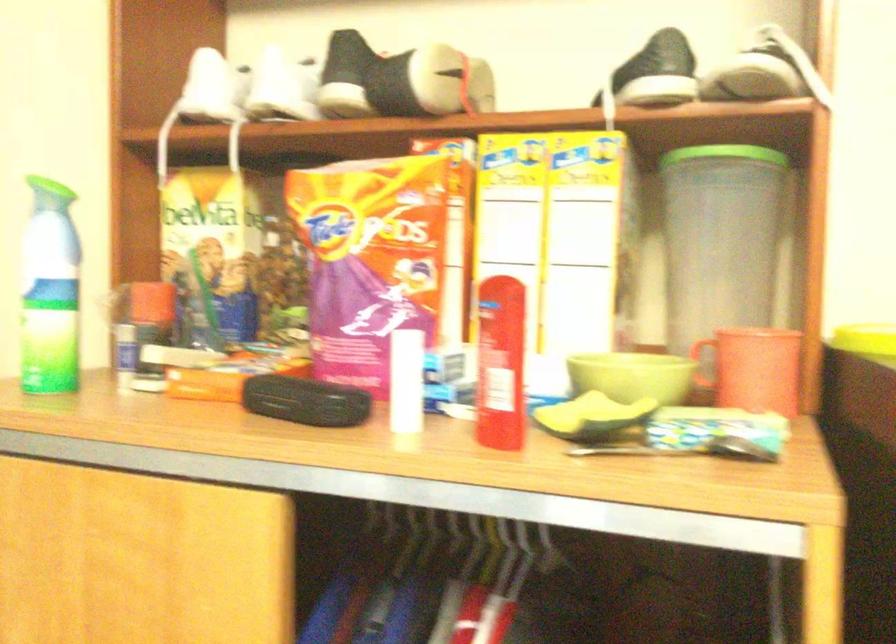
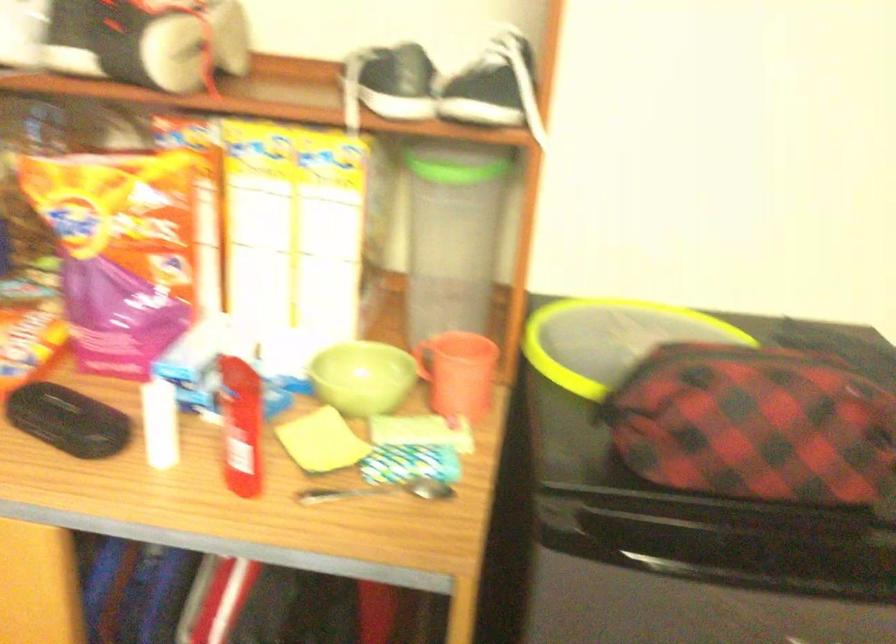
What movement of the cameraman would produce the second image?

The cameraman moved toward right, backward.